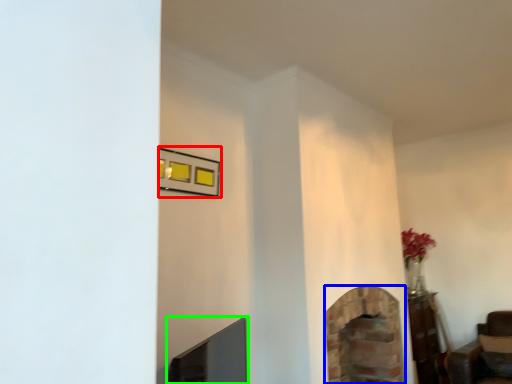
Question: Considering the real-world distances, which object is farthest from picture frame (highlighted by a red box)? fireplace (highlighted by a blue box) or fireplace (highlighted by a green box)?

Choices:
 (A) fireplace
 (B) fireplace

Answer: (A)